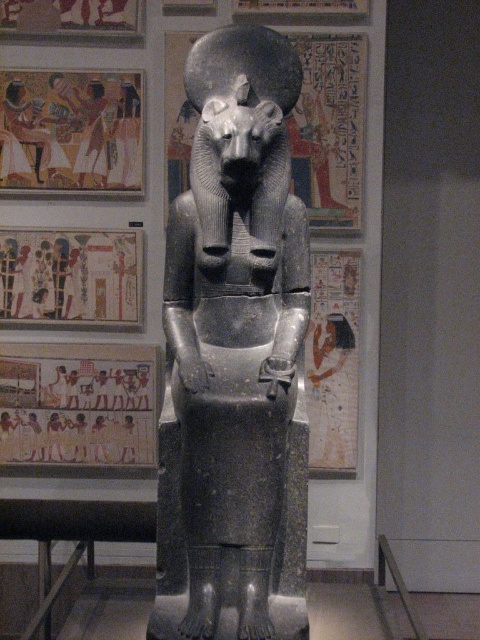
You are an art student visiting the museum and want to take a photo of both the matte stone hieroglyphics at center and the matte stone mural at left. Which one should you focus on first if you want to capture both in a single frame without moving the camera?

The matte stone hieroglyphics at center is bigger than the matte stone mural at left, so you should focus on the matte stone hieroglyphics at center first to ensure it fits properly in the frame before adjusting for the smaller matte stone mural at left.

You are an art student visiting the museum and want to draw the hieroglyphics and mural. You are standing in front of the statue. Which object should you turn to your left to reach first, the matte stone hieroglyphics at center or the matte stone mural at left?

The matte stone mural at left is to the left of the matte stone hieroglyphics at center. Since you are facing the statue, turning to your left would first face you toward the matte stone mural at left.

You are an art student analyzing the composition of the museum display. The scene has the matte stone hieroglyphics at center and earthy clay figures at upper left. Which object is positioned higher up in the image?

The earthy clay figures at upper left are positioned higher up in the image than the matte stone hieroglyphics at center.